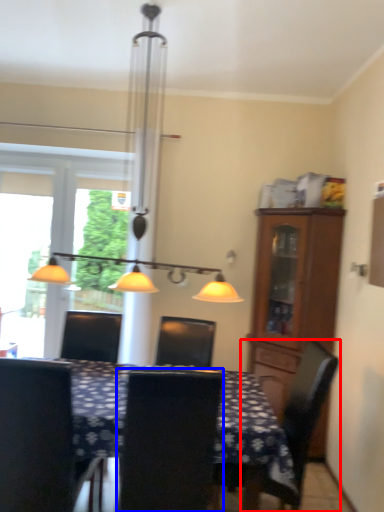
Question: Among these objects, which one is nearest to the camera, chair (highlighted by a red box) or chair (highlighted by a blue box)?

Choices:
 (A) chair
 (B) chair

Answer: (B)